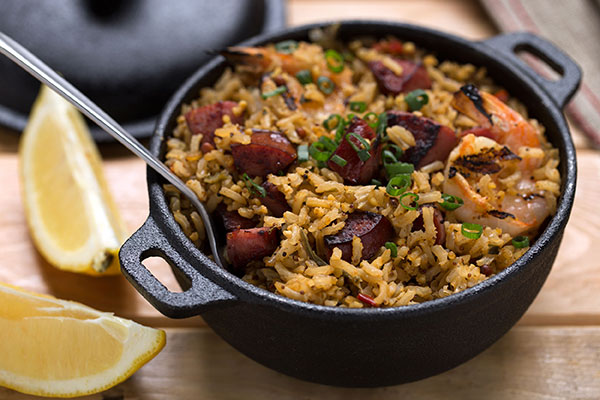
Where is `closest handle`? The image size is (600, 400). closest handle is located at coordinates (199, 290).